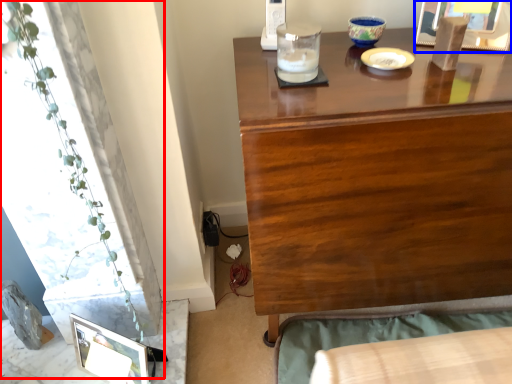
Question: Among these objects, which one is nearest to the camera, plant (highlighted by a red box) or picture frame (highlighted by a blue box)?

Choices:
 (A) plant
 (B) picture frame

Answer: (A)